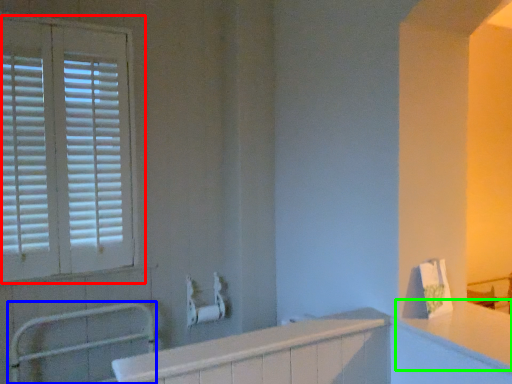
Question: Which is nearer to the window (highlighted by a red box)? balustrade (highlighted by a blue box) or counter top (highlighted by a green box).

Choices:
 (A) balustrade
 (B) counter top

Answer: (A)